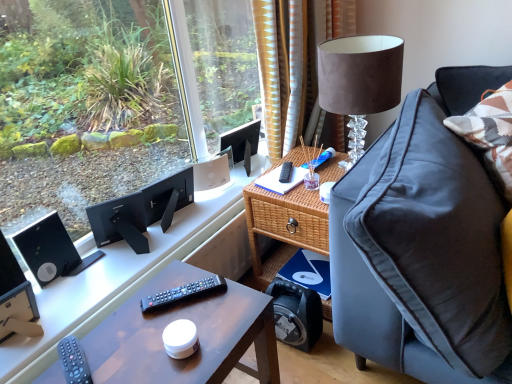
Question: Considering the relative sizes of matte black remote control at lower left, which ranks as the 1th remote control in bottom-to-top order, and black matte computer desk at left in the image provided, is matte black remote control at lower left, which ranks as the 1th remote control in bottom-to-top order, wider than black matte computer desk at left?

Choices:
 (A) no
 (B) yes

Answer: (A)

Question: Is black matte computer desk at left inside matte black remote control at lower left, the 1th remote control when ordered from front to back?

Choices:
 (A) yes
 (B) no

Answer: (B)

Question: Is matte black remote control at lower left, positioned as the third remote control in top-to-bottom order, facing away from black matte computer desk at left?

Choices:
 (A) no
 (B) yes

Answer: (A)

Question: Can you confirm if matte black remote control at lower left, which ranks as the 1th remote control in bottom-to-top order, is taller than black matte computer desk at left?

Choices:
 (A) no
 (B) yes

Answer: (A)

Question: Considering the relative sizes of matte black remote control at lower left, the 3th remote control positioned from the back, and black matte computer desk at left in the image provided, is matte black remote control at lower left, the 3th remote control positioned from the back, bigger than black matte computer desk at left?

Choices:
 (A) yes
 (B) no

Answer: (B)

Question: From a real-world perspective, is black plastic speaker at lower left, the second loudspeaker in the back-to-front sequence, physically located above or below matte black desk at center?

Choices:
 (A) below
 (B) above

Answer: (B)

Question: Is point (5, 241) positioned closer to the camera than point (134, 354)?

Choices:
 (A) farther
 (B) closer

Answer: (A)

Question: In terms of size, does black plastic speaker at lower left, the second loudspeaker in the back-to-front sequence, appear bigger or smaller than matte black desk at center?

Choices:
 (A) big
 (B) small

Answer: (B)

Question: Is black plastic speaker at lower left, the second loudspeaker in the back-to-front sequence, to the left or to the right of matte black desk at center in the image?

Choices:
 (A) right
 (B) left

Answer: (B)

Question: Do you think matte black desk at center is within suede lampshade at upper right, or outside of it?

Choices:
 (A) outside
 (B) inside

Answer: (A)

Question: From a real-world perspective, is matte black desk at center above or below suede lampshade at upper right?

Choices:
 (A) above
 (B) below

Answer: (B)

Question: Is matte black desk at center to the left or to the right of suede lampshade at upper right in the image?

Choices:
 (A) left
 (B) right

Answer: (A)

Question: From the image's perspective, relative to suede lampshade at upper right, is matte black desk at center above or below?

Choices:
 (A) below
 (B) above

Answer: (A)

Question: In terms of width, does black plastic speaker at lower left, the second loudspeaker in the back-to-front sequence, look wider or thinner when compared to white matte speaker at upper center?

Choices:
 (A) wide
 (B) thin

Answer: (A)

Question: Is black plastic speaker at lower left, the second loudspeaker in the back-to-front sequence, in front of or behind white matte speaker at upper center in the image?

Choices:
 (A) front
 (B) behind

Answer: (A)